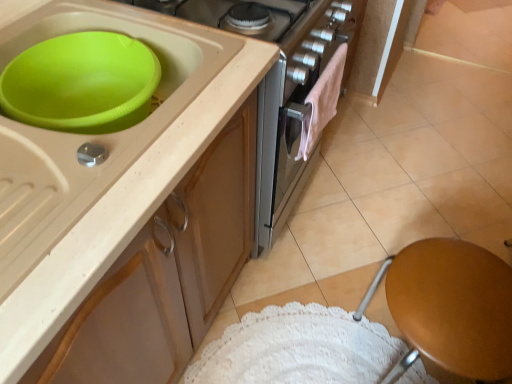
The height and width of the screenshot is (384, 512). What are the coordinates of `pink fluffy towel at center` in the screenshot? It's located at (322, 102).

The image size is (512, 384). Identify the location of matte beige cabinet at upper left. (123, 203).

Can you confirm if pink fluffy towel at center is taller than beige matte tile at upper right?

Indeed, pink fluffy towel at center has a greater height compared to beige matte tile at upper right.

Where is `clothe on the left side of beige matte tile at upper right`? The width and height of the screenshot is (512, 384). clothe on the left side of beige matte tile at upper right is located at coordinates (322, 102).

What's the angular difference between pink fluffy towel at center and beige matte tile at upper right's facing directions?

The angle between the facing direction of pink fluffy towel at center and the facing direction of beige matte tile at upper right is 87.3 degrees.

Considering the positions of objects pink fluffy towel at center and beige matte tile at upper right in the image provided, who is more to the left, pink fluffy towel at center or beige matte tile at upper right?

From the viewer's perspective, pink fluffy towel at center appears more on the left side.

Is brown wooden stool at lower right bigger than beige matte tile at upper right?

Indeed, brown wooden stool at lower right has a larger size compared to beige matte tile at upper right.

Between brown wooden stool at lower right and beige matte tile at upper right, which one is positioned behind?

beige matte tile at upper right is further away from the camera.

From the image's perspective, between brown wooden stool at lower right and beige matte tile at upper right, which one is located above?

beige matte tile at upper right.

In the image, is pink fluffy towel at center positioned in front of or behind brown wooden stool at lower right?

pink fluffy towel at center is behind brown wooden stool at lower right.

How different are the orientations of pink fluffy towel at center and brown wooden stool at lower right in degrees?

There is a 1.66-degree angle between the facing directions of pink fluffy towel at center and brown wooden stool at lower right.

Looking at this image, from the image's perspective, between pink fluffy towel at center and brown wooden stool at lower right, who is located below?

From the image's view, brown wooden stool at lower right is below.

From a real-world perspective, relative to matte beige cabinet at upper left, is beige matte tile at upper right vertically above or below?

Clearly, from a real-world perspective, beige matte tile at upper right is below matte beige cabinet at upper left.

Considering the points (467, 5) and (122, 269), which point is behind, point (467, 5) or point (122, 269)?

Point (467, 5)

From the image's perspective, which is above, beige matte tile at upper right or matte beige cabinet at upper left?

beige matte tile at upper right.

From the image's perspective, relative to matte beige cabinet at upper left, is brown wooden stool at lower right above or below?

Based on their image positions, brown wooden stool at lower right is located beneath matte beige cabinet at upper left.

Is brown wooden stool at lower right far away from matte beige cabinet at upper left?

brown wooden stool at lower right is actually quite close to matte beige cabinet at upper left.

From a real-world perspective, between brown wooden stool at lower right and matte beige cabinet at upper left, who is vertically higher?

matte beige cabinet at upper left, from a real-world perspective.

Based on the photo, which of these two, brown wooden stool at lower right or matte beige cabinet at upper left, is smaller?

Smaller between the two is matte beige cabinet at upper left.

Are matte beige cabinet at upper left and pink fluffy towel at center located far from each other?

No, matte beige cabinet at upper left is not far from pink fluffy towel at center.

From the image's perspective, is matte beige cabinet at upper left below pink fluffy towel at center?

Yes, from the image's perspective, matte beige cabinet at upper left is beneath pink fluffy towel at center.

Which object is thinner, matte beige cabinet at upper left or pink fluffy towel at center?

pink fluffy towel at center is thinner.

Is the surface of matte beige cabinet at upper left in direct contact with beige matte tile at upper right?

There is a gap between matte beige cabinet at upper left and beige matte tile at upper right.

Which is in front, matte beige cabinet at upper left or beige matte tile at upper right?

matte beige cabinet at upper left is in front.

Which of these two, matte beige cabinet at upper left or beige matte tile at upper right, is smaller?

beige matte tile at upper right.

The height and width of the screenshot is (384, 512). In order to click on tile below the pink fluffy towel at center (from a real-world perspective) in this screenshot , I will do `click(470, 32)`.

This screenshot has width=512, height=384. Identify the location of furniture in front of the beige matte tile at upper right. (450, 307).

When comparing their distances from brown wooden stool at lower right, does beige matte tile at upper right or matte beige cabinet at upper left seem closer?

The object closer to brown wooden stool at lower right is matte beige cabinet at upper left.

Which object lies nearer to the anchor point matte beige cabinet at upper left, brown wooden stool at lower right or beige matte tile at upper right?

brown wooden stool at lower right is closer to matte beige cabinet at upper left.

Considering their positions, is brown wooden stool at lower right positioned closer to beige matte tile at upper right than matte beige cabinet at upper left?

brown wooden stool at lower right lies closer to beige matte tile at upper right than the other object.

Considering their positions, is pink fluffy towel at center positioned further to beige matte tile at upper right than brown wooden stool at lower right?

brown wooden stool at lower right is positioned further to the anchor beige matte tile at upper right.

Based on their spatial positions, is brown wooden stool at lower right or pink fluffy towel at center closer to beige matte tile at upper right?

pink fluffy towel at center.

Estimate the real-world distances between objects in this image. Which object is further from matte beige cabinet at upper left, beige matte tile at upper right or pink fluffy towel at center?

Based on the image, beige matte tile at upper right appears to be further to matte beige cabinet at upper left.

Based on their spatial positions, is brown wooden stool at lower right or beige matte tile at upper right closer to pink fluffy towel at center?

brown wooden stool at lower right lies closer to pink fluffy towel at center than the other object.

Estimate the real-world distances between objects in this image. Which object is further from brown wooden stool at lower right, matte beige cabinet at upper left or beige matte tile at upper right?

beige matte tile at upper right is further to brown wooden stool at lower right.

Where is `clothe positioned between matte beige cabinet at upper left and beige matte tile at upper right from near to far`? The width and height of the screenshot is (512, 384). clothe positioned between matte beige cabinet at upper left and beige matte tile at upper right from near to far is located at coordinates (322, 102).

Find the location of a particular element. The width and height of the screenshot is (512, 384). clothe located between brown wooden stool at lower right and beige matte tile at upper right in the depth direction is located at coordinates (322, 102).

Identify the location of clothe situated between matte beige cabinet at upper left and brown wooden stool at lower right from left to right. (322, 102).

Identify the location of furniture positioned between matte beige cabinet at upper left and beige matte tile at upper right from near to far. (450, 307).